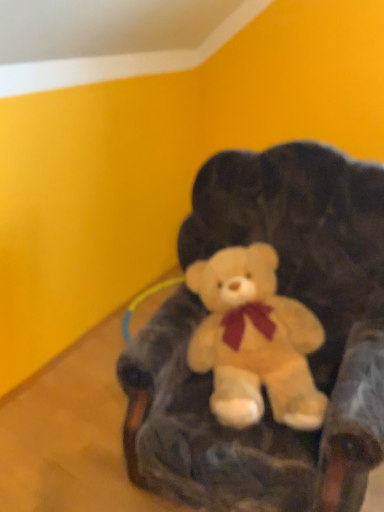
Question: Relative to velvety dark brown bean bag chair at center, is soft plush teddy bear at center in front or behind?

Choices:
 (A) behind
 (B) front

Answer: (A)

Question: From a real-world perspective, relative to velvety dark brown bean bag chair at center, is soft plush teddy bear at center vertically above or below?

Choices:
 (A) above
 (B) below

Answer: (B)

Question: In the image, is soft plush teddy bear at center on the left side or the right side of velvety dark brown bean bag chair at center?

Choices:
 (A) left
 (B) right

Answer: (A)

Question: From the image's perspective, relative to soft plush teddy bear at center, is velvety dark brown bean bag chair at center above or below?

Choices:
 (A) above
 (B) below

Answer: (A)

Question: Would you say velvety dark brown bean bag chair at center is to the left or to the right of soft plush teddy bear at center in the picture?

Choices:
 (A) left
 (B) right

Answer: (B)

Question: In terms of width, does velvety dark brown bean bag chair at center look wider or thinner when compared to soft plush teddy bear at center?

Choices:
 (A) wide
 (B) thin

Answer: (A)

Question: From a real-world perspective, is velvety dark brown bean bag chair at center physically located above or below soft plush teddy bear at center?

Choices:
 (A) above
 (B) below

Answer: (A)